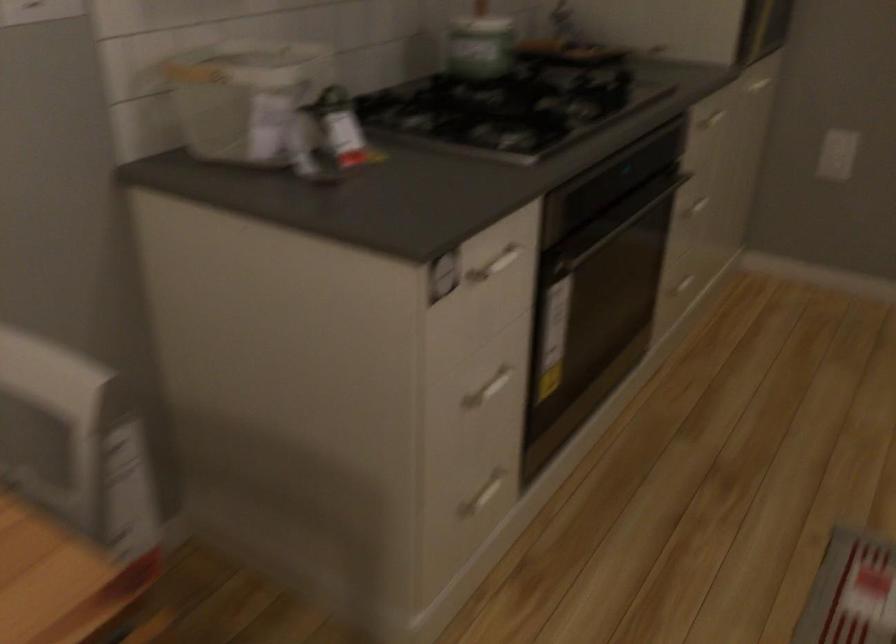
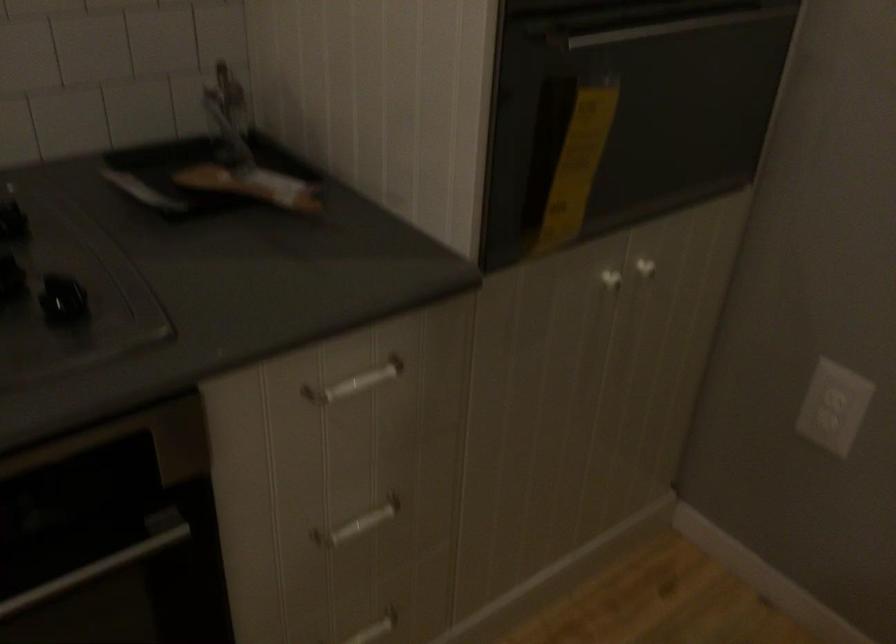
Find the pixel in the second image that matches point 762,77 in the first image.

(609, 278)